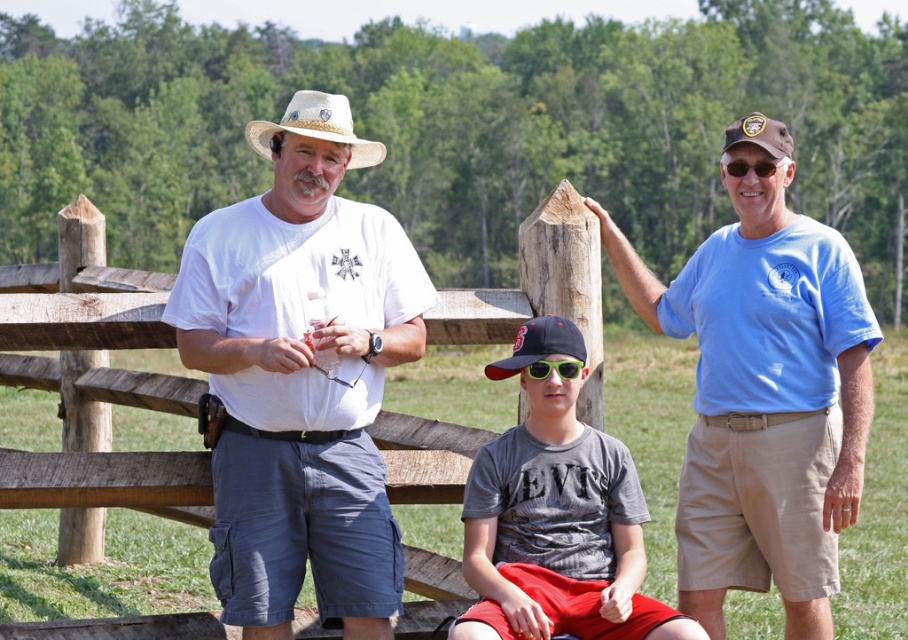
Does blue cotton shirt at right have a lesser height compared to straw hat at center?

No, blue cotton shirt at right is not shorter than straw hat at center.

Does blue cotton shirt at right appear on the left side of straw hat at center?

Incorrect, blue cotton shirt at right is not on the left side of straw hat at center.

You are a GUI agent. You are given a task and a screenshot of the screen. Output one action in this format:
    pyautogui.click(x=<x>, y=<y>)
    Task: Click on the blue cotton shirt at right
    The width and height of the screenshot is (908, 640).
    Given the screenshot: What is the action you would take?
    pyautogui.click(x=765, y=401)

Locate an element on the screen. The width and height of the screenshot is (908, 640). blue cotton shirt at right is located at coordinates [765, 401].

Looking at this image, can you confirm if gray cotton t-shirt at center is thinner than brown straw hat at upper right?

Indeed, gray cotton t-shirt at center has a lesser width compared to brown straw hat at upper right.

Describe the element at coordinates (556, 516) in the screenshot. I see `gray cotton t-shirt at center` at that location.

Who is more distant from viewer, (x=551, y=538) or (x=788, y=147)?

Point (x=788, y=147)

At what (x,y) coordinates should I click in order to perform the action: click on gray cotton t-shirt at center. Please return your answer as a coordinate pair (x, y). Looking at the image, I should click on (556, 516).

What do you see at coordinates (765, 401) in the screenshot? This screenshot has height=640, width=908. I see `blue cotton shirt at right` at bounding box center [765, 401].

Which is behind, point (739, 317) or point (757, 161)?

The point (739, 317) is behind.

Image resolution: width=908 pixels, height=640 pixels. What are the coordinates of `blue cotton shirt at right` in the screenshot? It's located at (765, 401).